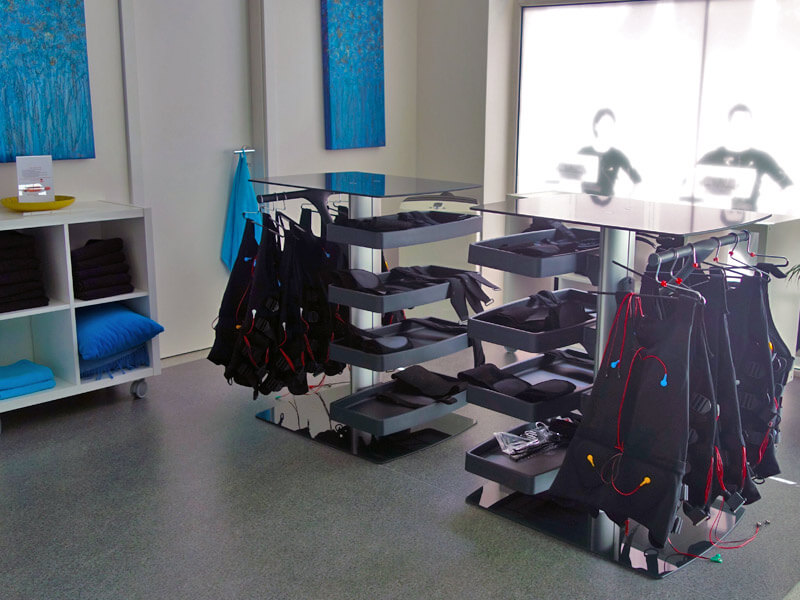
The image size is (800, 600). In order to click on blue pillow in this screenshot , I will do `click(96, 325)`.